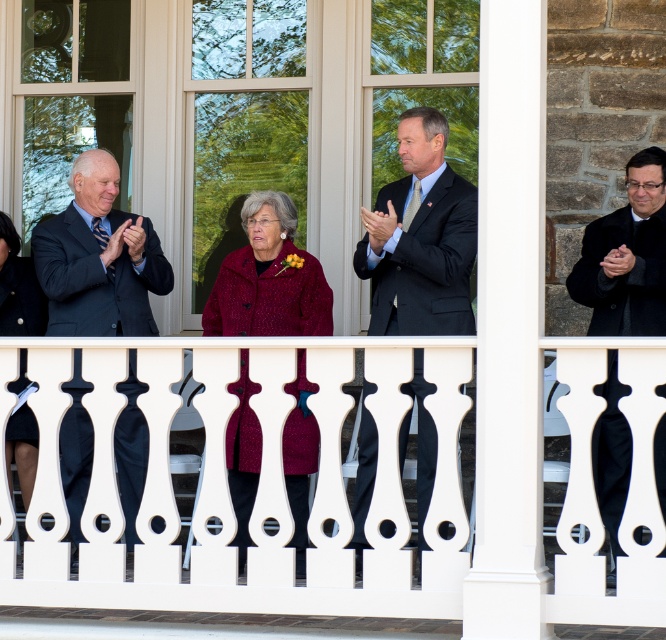
You are standing on a balcony where a formal event is taking place. You see a dark blue suit at left and another person at right. How far apart are these two individuals?

The dark blue suit at left and the other person at right are 11.74 meters apart.

You are a photographer trying to capture the perfect shot of the burgundy textured coat at center during the ceremony. The camera you are using has a focal length of 50mm and an aperture of f2.8. Based on the coordinates provided, can you determine if the coat is within the camera frame? Please explain your reasoning.

The position of the burgundy textured coat at center is at point coordinates, so it is within the camera frame as it is positioned at the center coordinates provided.